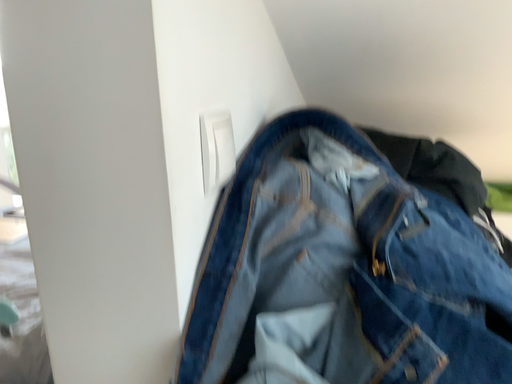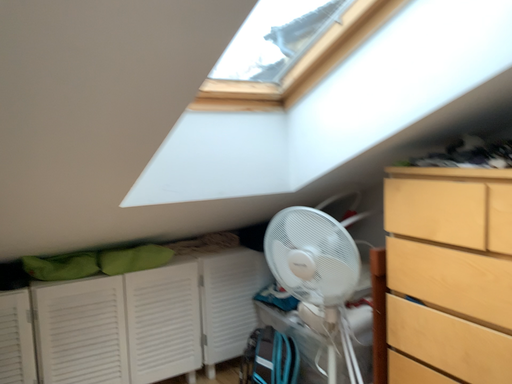
Question: Which way did the camera rotate in the video?

Choices:
 (A) rotated right
 (B) rotated left

Answer: (A)